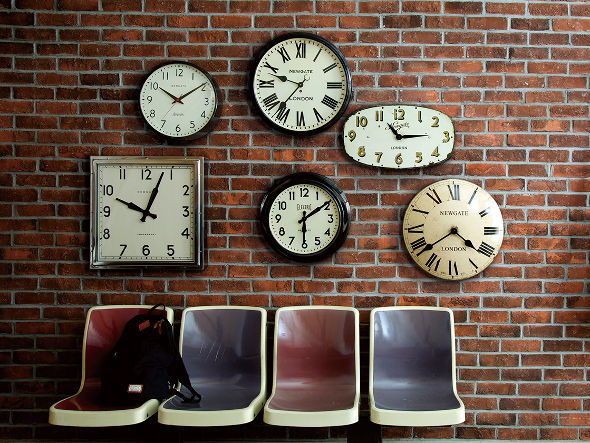
Where is `clocks`? This screenshot has height=443, width=590. clocks is located at coordinates (327, 218), (129, 210), (314, 97), (160, 122), (408, 139), (478, 244).